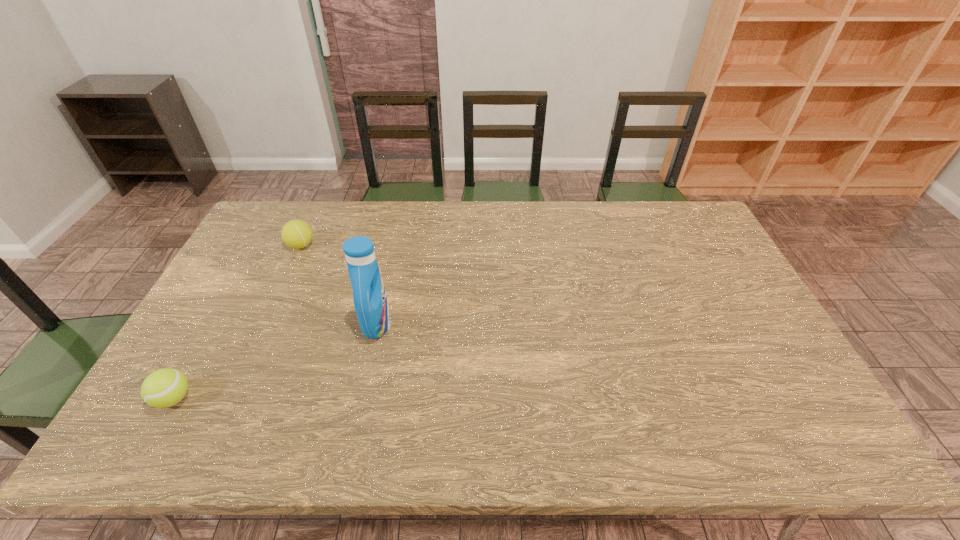
Identify the location of detergent. This screenshot has height=540, width=960. point(371,305).

The width and height of the screenshot is (960, 540). In order to click on the tallest object in this screenshot , I will do `click(371, 305)`.

The image size is (960, 540). Identify the location of the second object from left to right. (296, 234).

The width and height of the screenshot is (960, 540). Identify the location of the farthest object. (296, 234).

The width and height of the screenshot is (960, 540). Find the location of `the nearest object`. the nearest object is located at coordinates (165, 387).

This screenshot has height=540, width=960. What are the coordinates of `the leftmost object` in the screenshot? It's located at click(x=165, y=387).

The height and width of the screenshot is (540, 960). What are the coordinates of `free space located on the front-facing side of the detergent` in the screenshot? It's located at (515, 323).

The width and height of the screenshot is (960, 540). Identify the location of free space located on the right of the right tennis ball. (372, 245).

Locate an element on the screen. The height and width of the screenshot is (540, 960). free location located on the back of the nearest object is located at coordinates (204, 343).

At what (x,y) coordinates should I click in order to perform the action: click on object present at the far edge. Please return your answer as a coordinate pair (x, y). This screenshot has height=540, width=960. Looking at the image, I should click on (296, 234).